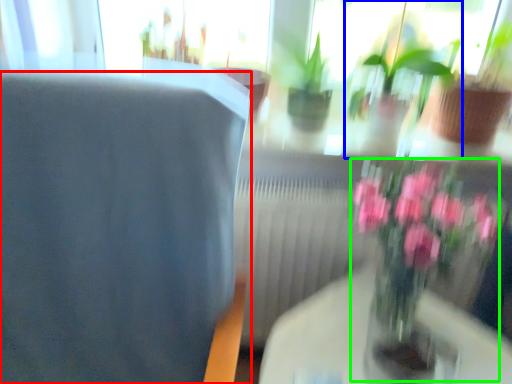
Question: Considering the real-world distances, which object is farthest from chair (highlighted by a red box)? houseplant (highlighted by a blue box) or floral arrangement (highlighted by a green box)?

Choices:
 (A) houseplant
 (B) floral arrangement

Answer: (A)